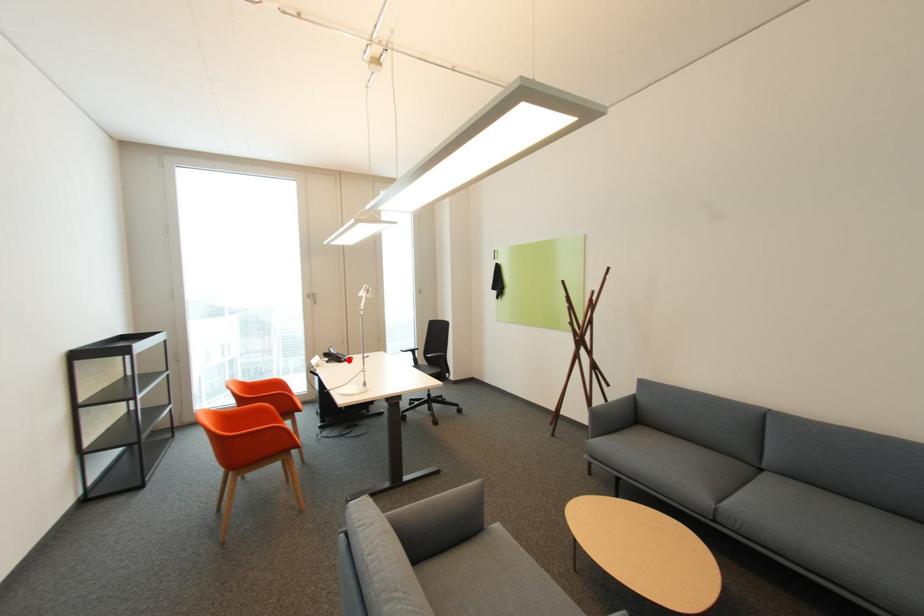
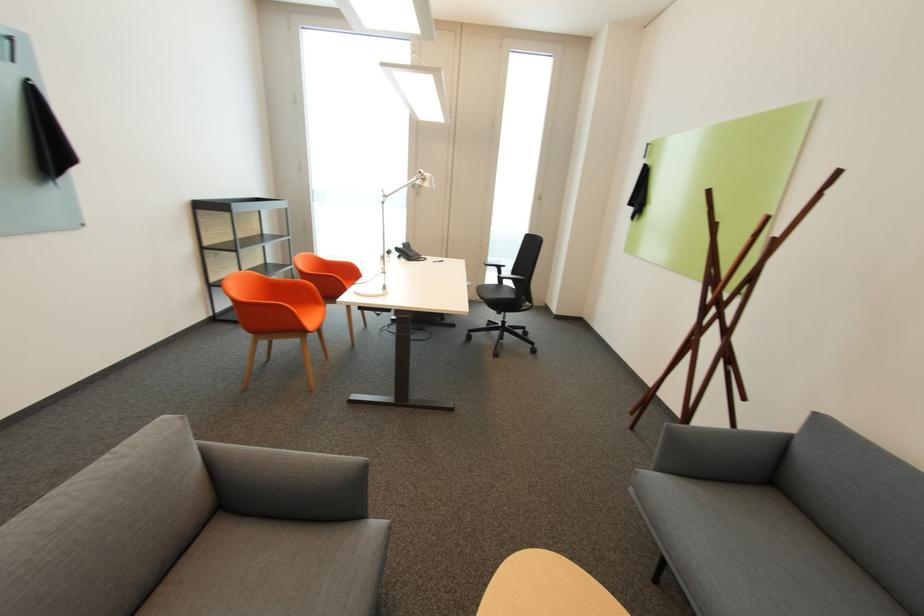
In the second image, find the point that corresponds to the highlighted location in the first image.

(419, 259)